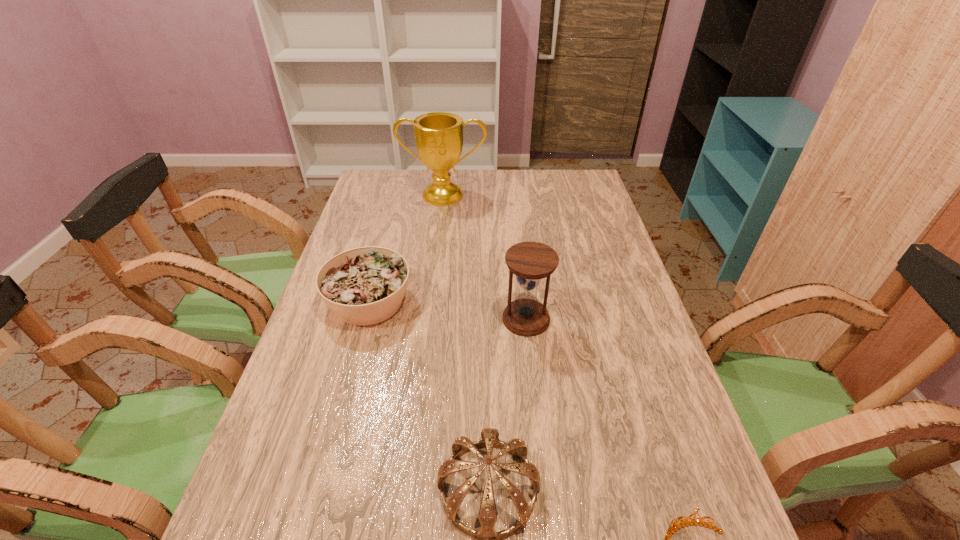
You are a GUI agent. You are given a task and a screenshot of the screen. Output one action in this format:
    pyautogui.click(x=<x>, y=<y>)
    Task: Click on the empty space that is in between the fourth shortest object and the farthest object
    This screenshot has height=540, width=960.
    Given the screenshot: What is the action you would take?
    pyautogui.click(x=485, y=257)

Locate an element on the screen. The image size is (960, 540). the fourth closest object to the shorter tiara is located at coordinates pyautogui.click(x=438, y=135).

Locate which object is the closest to the shortest object. Please provide its 2D coordinates. Your answer should be formatted as a tuple, i.e. [(x, y)], where the tuple contains the x and y coordinates of a point satisfying the conditions above.

[(488, 539)]

This screenshot has width=960, height=540. Find the location of `vacant area in the image that satisfies the following two spatial constraints: 1. on the shiny surface of the hourglass; 2. on the left side of the farthest object`. vacant area in the image that satisfies the following two spatial constraints: 1. on the shiny surface of the hourglass; 2. on the left side of the farthest object is located at coordinates (429, 319).

Find the location of a particular element. The image size is (960, 540). free location that satisfies the following two spatial constraints: 1. on the front side of the salad; 2. on the right side of the hourglass is located at coordinates (365, 319).